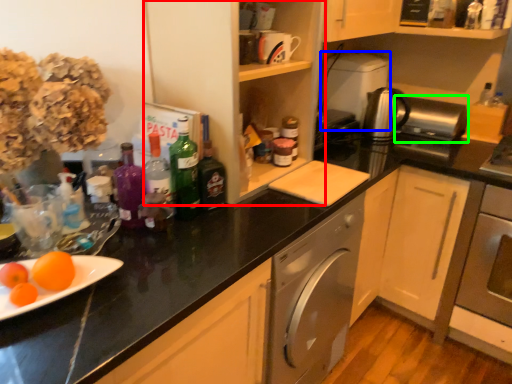
Question: Which is nearer to the cabinetry (highlighted by a red box)? appliance (highlighted by a blue box) or appliance (highlighted by a green box).

Choices:
 (A) appliance
 (B) appliance

Answer: (A)